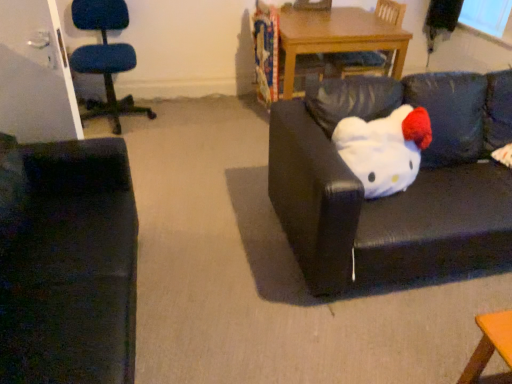
Question: Considering the relative sizes of black leather couch at center, arranged as the 2th studio couch when viewed from the left, and white plush toy at right in the image provided, is black leather couch at center, arranged as the 2th studio couch when viewed from the left, taller than white plush toy at right?

Choices:
 (A) yes
 (B) no

Answer: (A)

Question: Is black leather couch at center, which ranks as the first studio couch in right-to-left order, aimed at white plush toy at right?

Choices:
 (A) yes
 (B) no

Answer: (A)

Question: Is black leather couch at center, arranged as the 2th studio couch when viewed from the left, further to camera compared to white plush toy at right?

Choices:
 (A) yes
 (B) no

Answer: (B)

Question: Can you confirm if black leather couch at center, which ranks as the first studio couch in right-to-left order, is positioned to the right of white plush toy at right?

Choices:
 (A) yes
 (B) no

Answer: (A)

Question: Is white plush toy at right inside black leather couch at center, which ranks as the first studio couch in right-to-left order?

Choices:
 (A) yes
 (B) no

Answer: (A)

Question: From a real-world perspective, is black leather couch at center, arranged as the 2th studio couch when viewed from the left, positioned over white plush toy at right based on gravity?

Choices:
 (A) no
 (B) yes

Answer: (A)

Question: Does wooden chair at upper center, which appears as the second chair when viewed from the left, appear on the left side of white plush toy at right?

Choices:
 (A) no
 (B) yes

Answer: (A)

Question: Can you confirm if wooden chair at upper center, which appears as the second chair when viewed from the left, is taller than white plush toy at right?

Choices:
 (A) yes
 (B) no

Answer: (A)

Question: Can you confirm if wooden chair at upper center, the first chair from the right, is bigger than white plush toy at right?

Choices:
 (A) no
 (B) yes

Answer: (B)

Question: Is the surface of wooden chair at upper center, the first chair from the right, in direct contact with white plush toy at right?

Choices:
 (A) yes
 (B) no

Answer: (B)

Question: From the image's perspective, would you say wooden chair at upper center, the first chair from the right, is shown under white plush toy at right?

Choices:
 (A) yes
 (B) no

Answer: (B)

Question: From a real-world perspective, does wooden chair at upper center, the first chair from the right, sit lower than white plush toy at right?

Choices:
 (A) no
 (B) yes

Answer: (B)

Question: Is white plush toy at right positioned before black leather couch at center, arranged as the 2th studio couch when viewed from the left?

Choices:
 (A) yes
 (B) no

Answer: (B)